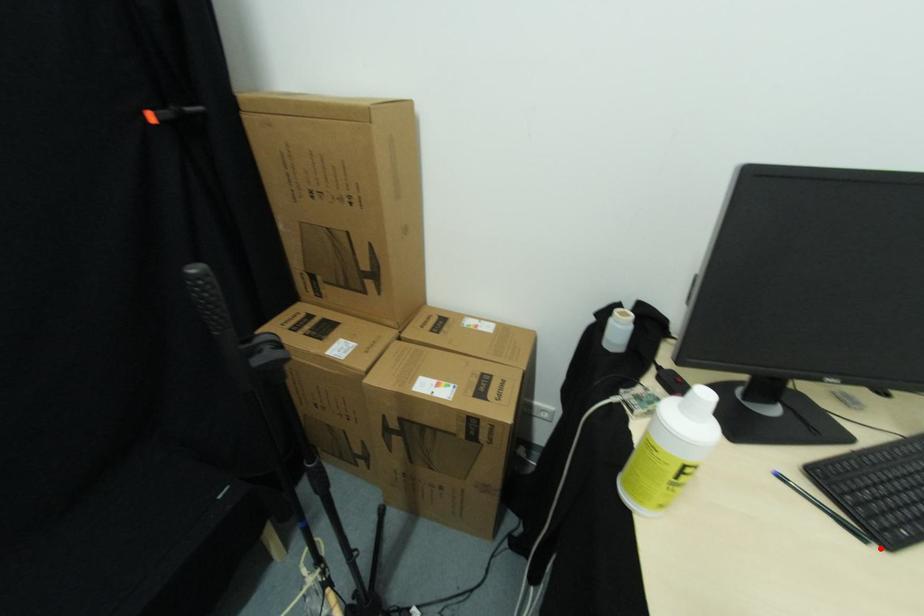
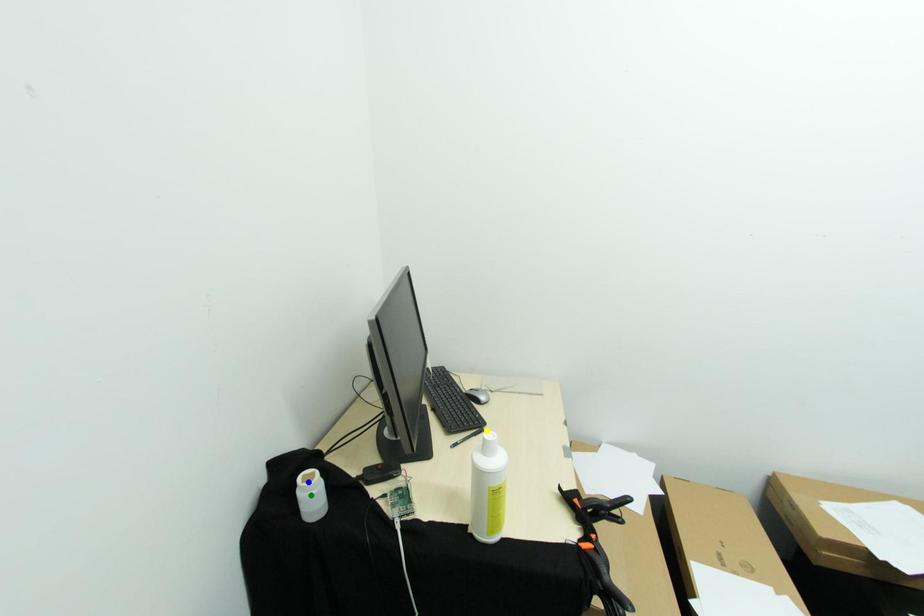
Question: I am providing you with two images of the same scene from different viewpoints. A red point is marked on the first image. You are given multiple points on the second image. Which spot in image 2 lines up with the point in image 1?

Choices:
 (A) blue point
 (B) green point
 (C) yellow point

Answer: (C)